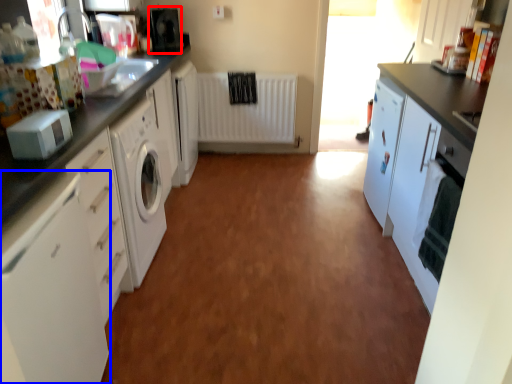
Question: Which point is closer to the camera, appliance (highlighted by a red box) or cabinetry (highlighted by a blue box)?

Choices:
 (A) appliance
 (B) cabinetry

Answer: (B)